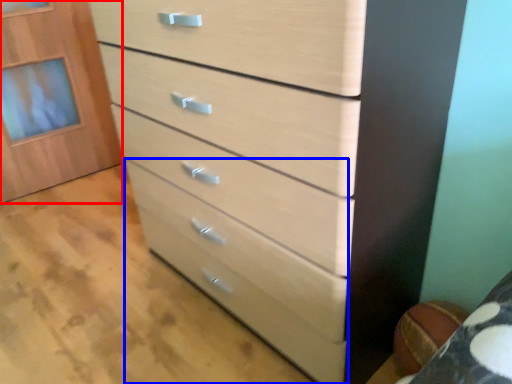
Question: Which object appears closest to the camera in this image, cabinetry (highlighted by a red box) or drawer (highlighted by a blue box)?

Choices:
 (A) cabinetry
 (B) drawer

Answer: (B)